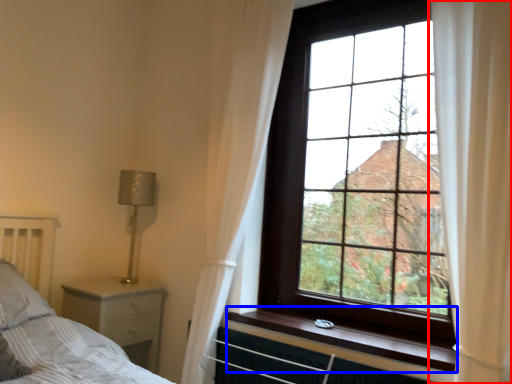
Question: Among these objects, which one is farthest to the camera, curtain (highlighted by a red box) or window sill (highlighted by a blue box)?

Choices:
 (A) curtain
 (B) window sill

Answer: (B)